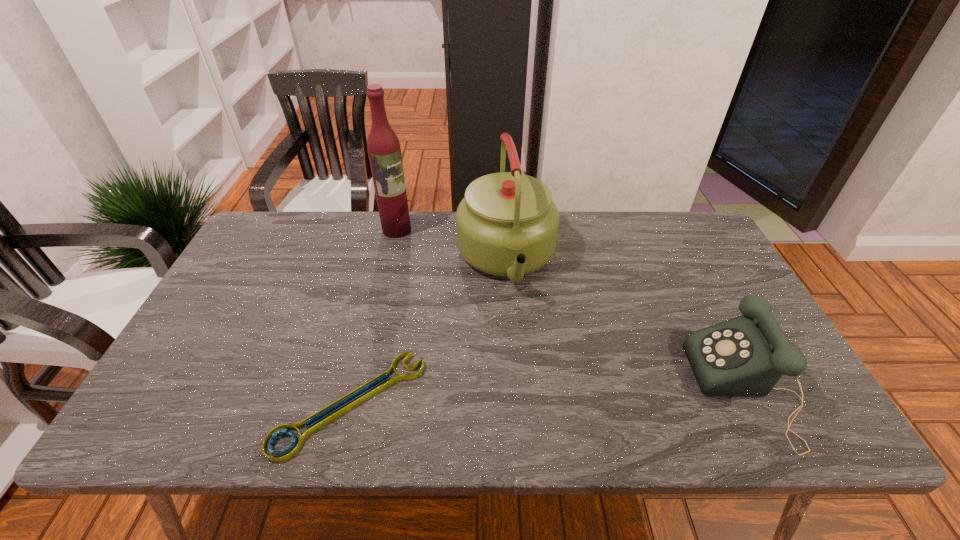
At what (x,y) coordinates should I click in order to perform the action: click on wrench. Please return your answer as a coordinate pair (x, y). The image size is (960, 540). Looking at the image, I should click on (285, 454).

Identify the location of telephone. (747, 355).

Where is `the rightmost object`? Image resolution: width=960 pixels, height=540 pixels. the rightmost object is located at coordinates (747, 355).

Locate an element on the screen. The width and height of the screenshot is (960, 540). the second tallest object is located at coordinates (507, 225).

Where is `the second object from right to left`? This screenshot has width=960, height=540. the second object from right to left is located at coordinates (507, 225).

The width and height of the screenshot is (960, 540). Find the location of `liquor`. liquor is located at coordinates (384, 151).

You are a GUI agent. You are given a task and a screenshot of the screen. Output one action in this format:
    pyautogui.click(x=<x>, y=<y>)
    Task: Click on the vacant space located 0.390m on the back of the wrench
    This screenshot has height=540, width=960.
    Given the screenshot: What is the action you would take?
    pyautogui.click(x=387, y=253)

Where is `free spot located 0.130m on the dial of the rightmost object`? free spot located 0.130m on the dial of the rightmost object is located at coordinates (642, 389).

The height and width of the screenshot is (540, 960). I want to click on free spot located on the dial of the rightmost object, so click(x=660, y=389).

Image resolution: width=960 pixels, height=540 pixels. What are the coordinates of `free region located on the dial of the rightmost object` in the screenshot? It's located at (607, 389).